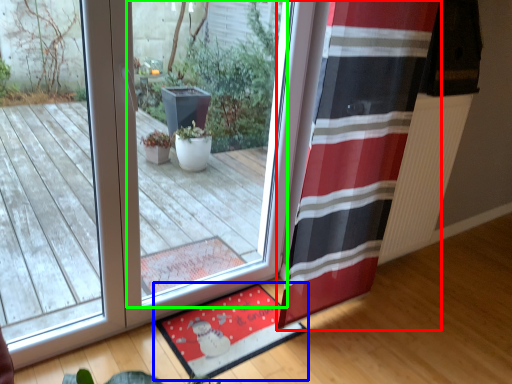
Question: Based on their relative distances, which object is farther from curtain (highlighted by a red box)? Choose from mat (highlighted by a blue box) and window (highlighted by a green box).

Choices:
 (A) mat
 (B) window

Answer: (B)